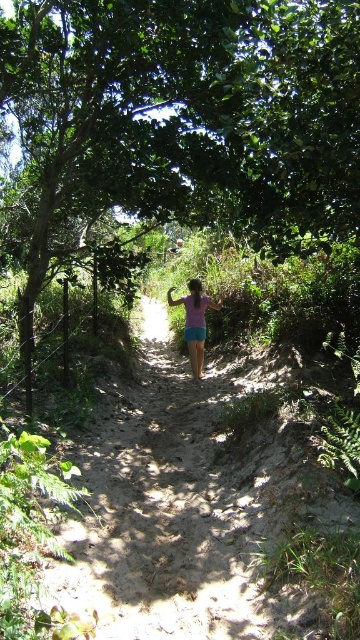
Measure the distance between green leafy tree at center and purple cotton shorts at center.

green leafy tree at center is 3.85 meters from purple cotton shorts at center.

Who is positioned more to the left, green leafy tree at center or purple cotton shorts at center?

Positioned to the left is green leafy tree at center.

Between point (69, 193) and point (194, 339), which one is positioned behind?

Positioned behind is point (194, 339).

Where is `green leafy tree at center`? green leafy tree at center is located at coordinates (200, 109).

Is pink fabric shorts at center positioned at the back of purple cotton shorts at center?

Yes, it is behind purple cotton shorts at center.

Does point (218, 301) come closer to viewer compared to point (186, 333)?

That is False.

Where is `pink fabric shorts at center`? The image size is (360, 640). pink fabric shorts at center is located at coordinates (195, 323).

Does green leafy tree at center have a larger size compared to pink fabric shorts at center?

Yes.

Who is shorter, green leafy tree at center or pink fabric shorts at center?

Standing shorter between the two is pink fabric shorts at center.

Identify the location of green leafy tree at center. The width and height of the screenshot is (360, 640). (200, 109).